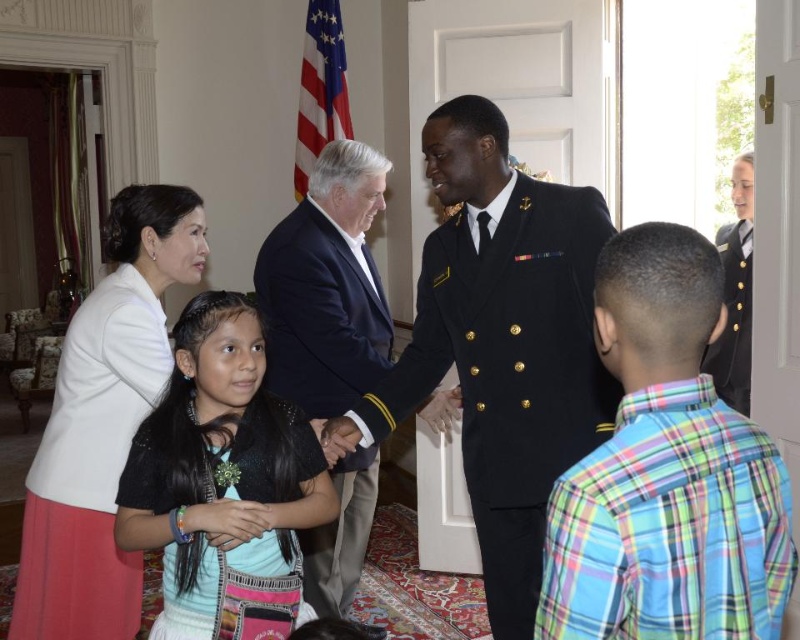
You are standing at the entrance of the room and want to move towards the point that is closer to the white door in the background. Which point should you head towards, point (154, 435) or point (314, 214)?

Point (154, 435) is in front of point (314, 214), so it is closer to the white door in the background. You should head towards point (154, 435).